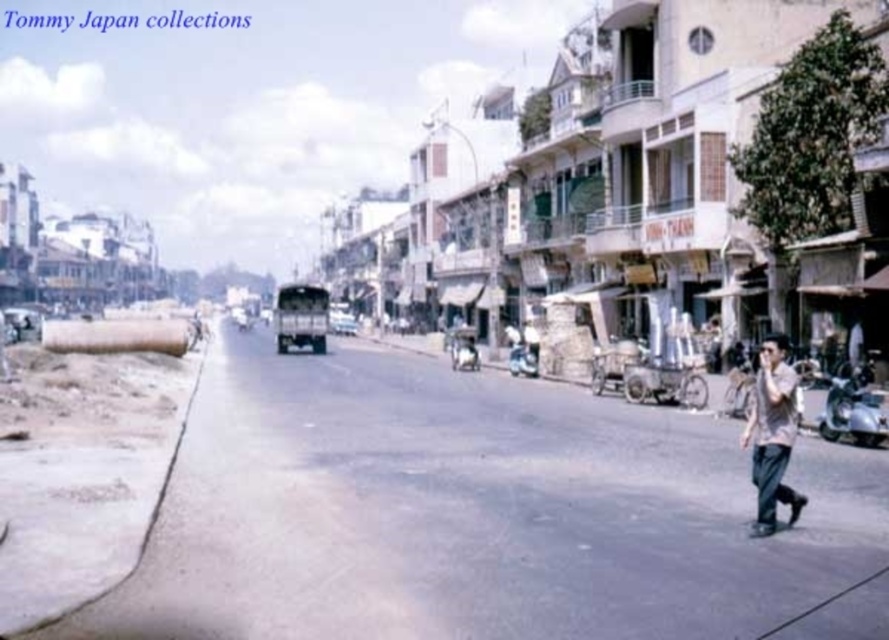
Is point (765, 428) less distant than point (346, 320)?

Yes.

Can you confirm if light brown cotton shirt at lower right is shorter than metallic silver bus at center?

Incorrect, light brown cotton shirt at lower right's height does not fall short of metallic silver bus at center's.

At what (x,y) coordinates should I click in order to perform the action: click on light brown cotton shirt at lower right. Please return your answer as a coordinate pair (x, y). Looking at the image, I should click on (773, 435).